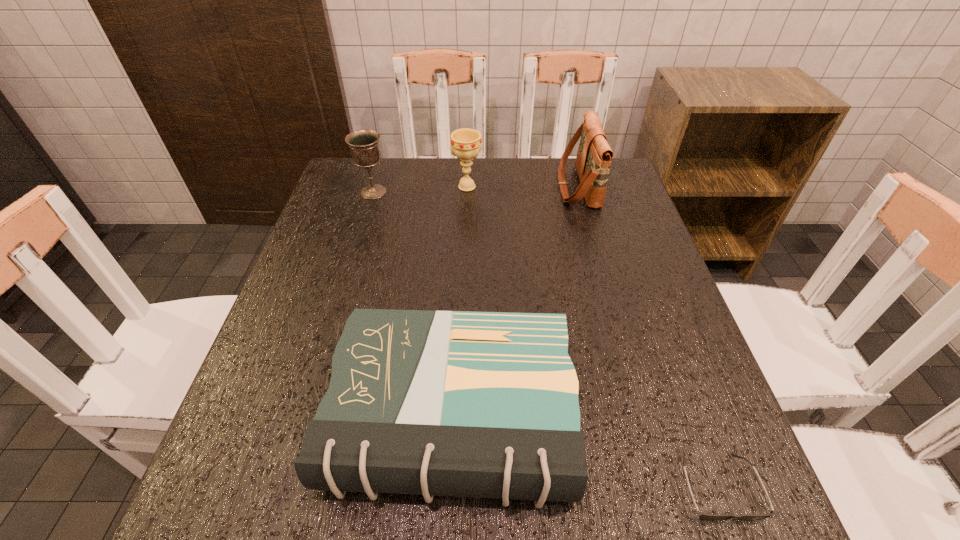
Locate an element on the screen. The width and height of the screenshot is (960, 540). free area in between the left chalice and the paperback book is located at coordinates point(413,305).

Identify which object is the closest to the shoulder bag. Please provide its 2D coordinates. Your answer should be formatted as a tuple, i.e. [(x, y)], where the tuple contains the x and y coordinates of a point satisfying the conditions above.

[(465, 143)]

Find the location of `object that ranks as the fourth closest to the right chalice`. object that ranks as the fourth closest to the right chalice is located at coordinates (710, 517).

Where is `blank space that satisfies the following two spatial constraints: 1. on the back side of the right chalice; 2. on the right side of the fourth tallest object`? The width and height of the screenshot is (960, 540). blank space that satisfies the following two spatial constraints: 1. on the back side of the right chalice; 2. on the right side of the fourth tallest object is located at coordinates (463, 187).

You are a GUI agent. You are given a task and a screenshot of the screen. Output one action in this format:
    pyautogui.click(x=<x>, y=<y>)
    Task: Click on the free region that satisfies the following two spatial constraints: 1. on the front side of the second shortest object; 2. on the right side of the left chalice
    
    Given the screenshot: What is the action you would take?
    pyautogui.click(x=306, y=417)